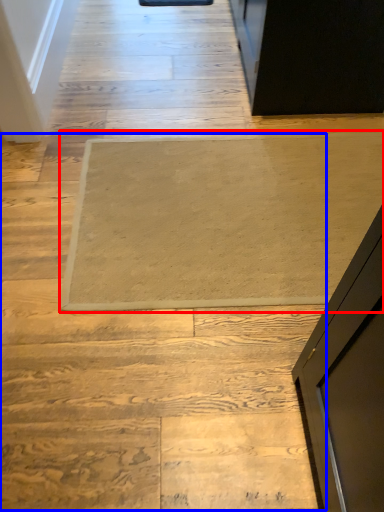
Question: Which point is further to the camera, mat (highlighted by a red box) or stairwell (highlighted by a blue box)?

Choices:
 (A) mat
 (B) stairwell

Answer: (A)